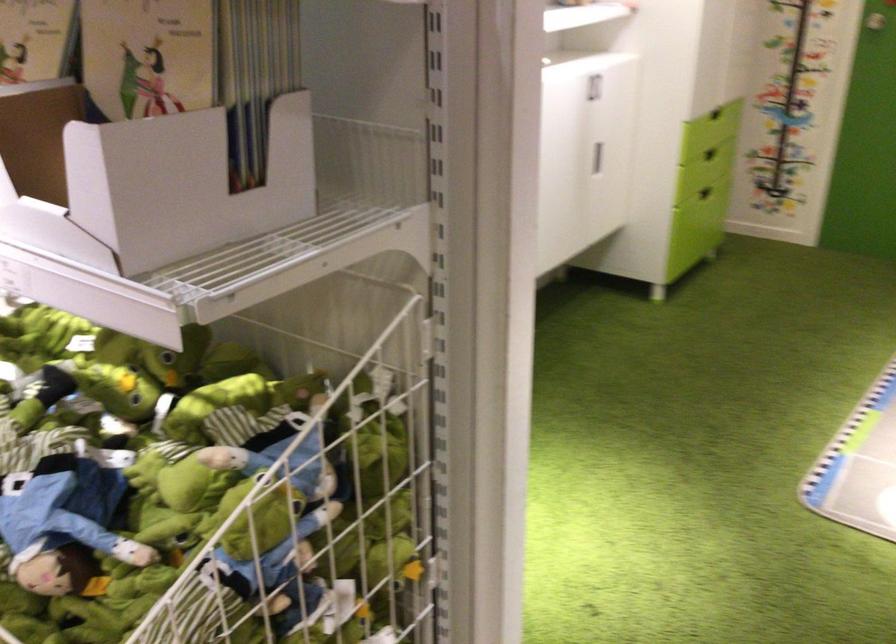
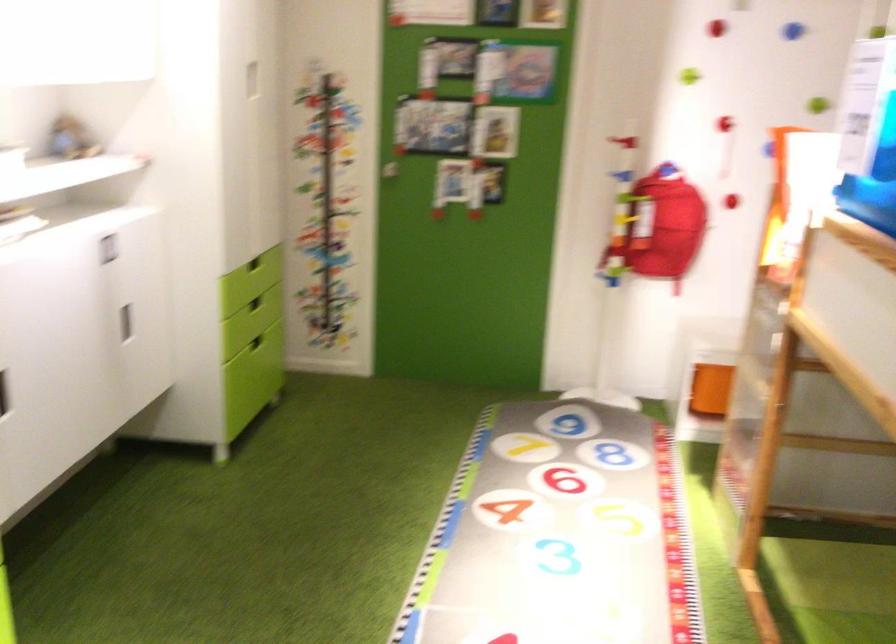
Question: The camera is either moving clockwise (left) or counter-clockwise (right) around the object. The first image is from the beginning of the video and the second image is from the end. Is the camera moving left or right when shooting the video?

Choices:
 (A) Left
 (B) Right

Answer: (A)